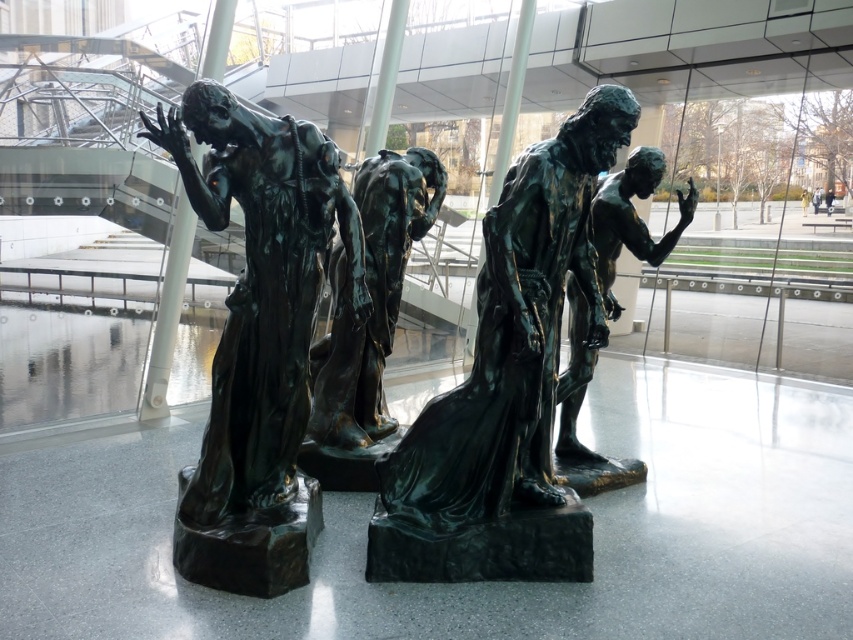
Does point (376, 428) come farther from viewer compared to point (601, 284)?

Yes.

Who is higher up, bronze figure at center or bronze statue at center?

bronze figure at center is above.

This screenshot has width=853, height=640. What do you see at coordinates (370, 298) in the screenshot? I see `bronze figure at center` at bounding box center [370, 298].

I want to click on bronze figure at center, so click(x=370, y=298).

Between point (242, 284) and point (590, 353), which one is positioned in front?

Point (242, 284)

Between bronze statue at left and bronze statue at center, which one has less height?

With less height is bronze statue at center.

Identify the location of bronze statue at left. (259, 337).

At what (x,y) coordinates should I click in order to perform the action: click on bronze statue at left. Please return your answer as a coordinate pair (x, y). Looking at the image, I should click on (259, 337).

In order to click on bronze statue at center in this screenshot , I will do `click(631, 218)`.

Is bronze statue at center thinner than light brown leather jacket at center?

Incorrect, bronze statue at center's width is not less than light brown leather jacket at center's.

At what (x,y) coordinates should I click in order to perform the action: click on bronze statue at center. Please return your answer as a coordinate pair (x, y). The width and height of the screenshot is (853, 640). Looking at the image, I should click on (631, 218).